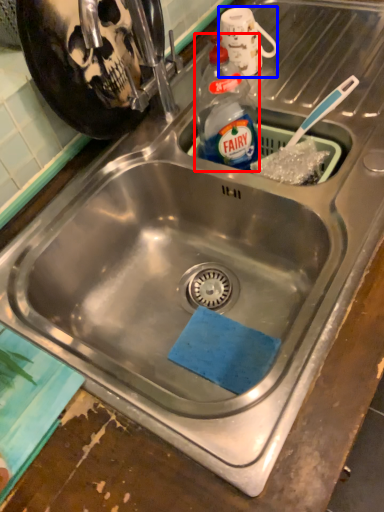
Question: Which object is further to the camera taking this photo, bottle (highlighted by a red box) or mug (highlighted by a blue box)?

Choices:
 (A) bottle
 (B) mug

Answer: (B)